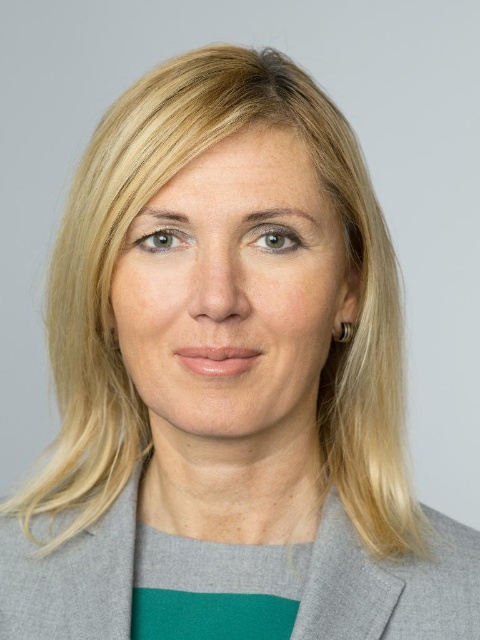
Question: Which point is farther to the camera?

Choices:
 (A) (339, 524)
 (B) (191, 296)

Answer: (A)

Question: Is smooth skin face at center wider than gray woolen blazer at center?

Choices:
 (A) yes
 (B) no

Answer: (B)

Question: Observing the image, what is the correct spatial positioning of smooth skin face at center in reference to gray woolen blazer at center?

Choices:
 (A) left
 (B) right

Answer: (B)

Question: Which point is closer to the camera taking this photo?

Choices:
 (A) (48, 634)
 (B) (292, 362)

Answer: (B)

Question: Does smooth skin face at center lie in front of gray woolen blazer at center?

Choices:
 (A) no
 (B) yes

Answer: (B)